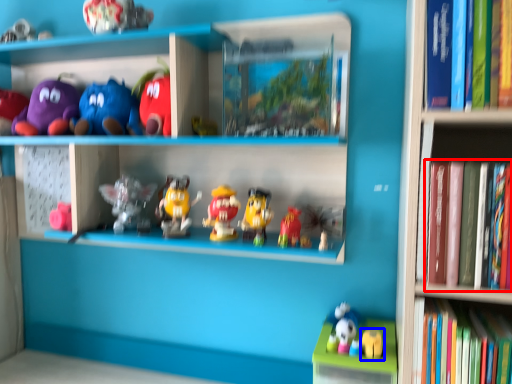
Question: Which point is further to the camera, book (highlighted by a red box) or toy (highlighted by a blue box)?

Choices:
 (A) book
 (B) toy

Answer: (B)